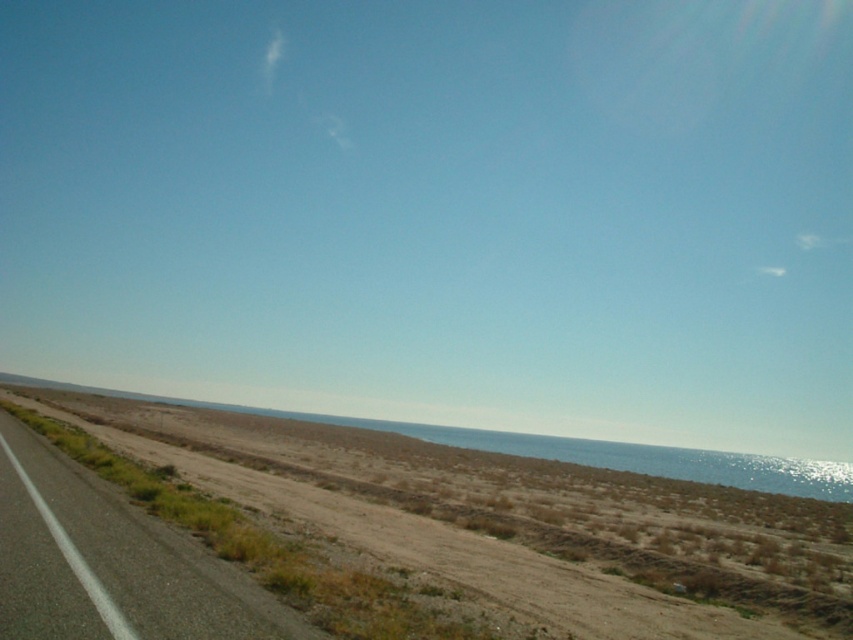
Who is positioned more to the left, brown sandy desert at lower left or asphalt road at left?

asphalt road at left is more to the left.

Which of these two, brown sandy desert at lower left or asphalt road at left, stands taller?

With more height is brown sandy desert at lower left.

This screenshot has height=640, width=853. What do you see at coordinates (515, 512) in the screenshot? I see `brown sandy desert at lower left` at bounding box center [515, 512].

You are a GUI agent. You are given a task and a screenshot of the screen. Output one action in this format:
    pyautogui.click(x=<x>, y=<y>)
    Task: Click on the brown sandy desert at lower left
    
    Given the screenshot: What is the action you would take?
    pyautogui.click(x=515, y=512)

Does brown sandy desert at lower left come behind brown/dry soil at center?

No, it is not.

Locate an element on the screen. This screenshot has height=640, width=853. brown sandy desert at lower left is located at coordinates (515, 512).

Is point (57, 516) farther from camera compared to point (682, 468)?

That is False.

Can you confirm if asphalt road at left is positioned below brown/dry soil at center?

Incorrect, asphalt road at left is not positioned below brown/dry soil at center.

Identify the location of asphalt road at left. The width and height of the screenshot is (853, 640). (x=112, y=561).

Find the location of a particular element. The height and width of the screenshot is (640, 853). asphalt road at left is located at coordinates (112, 561).